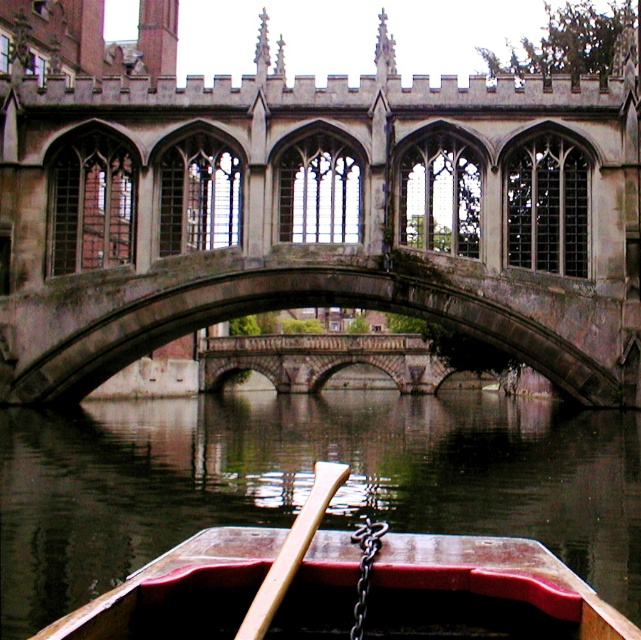
Can you confirm if stone gothic bridge at center is wider than wooden canoe at center?

Yes, stone gothic bridge at center is wider than wooden canoe at center.

Between stone gothic bridge at center and wooden canoe at center, which one appears on the left side from the viewer's perspective?

stone gothic bridge at center is more to the left.

Is point (463, 296) positioned before point (542, 592)?

No, it is behind (542, 592).

Locate an element on the screen. The image size is (641, 640). stone gothic bridge at center is located at coordinates (317, 214).

Which of these two, stone gothic bridge at center or wooden at center, stands shorter?

With less height is wooden at center.

In the scene shown: Is stone gothic bridge at center smaller than wooden at center?

No, stone gothic bridge at center is not smaller than wooden at center.

This screenshot has height=640, width=641. What do you see at coordinates (317, 214) in the screenshot?
I see `stone gothic bridge at center` at bounding box center [317, 214].

The image size is (641, 640). What are the coordinates of `stone gothic bridge at center` in the screenshot? It's located at (317, 214).

Based on the photo, who is positioned more to the left, stone gothic bridge at center or dark water at center?

Positioned to the left is stone gothic bridge at center.

Where is `stone gothic bridge at center`? This screenshot has height=640, width=641. stone gothic bridge at center is located at coordinates (317, 214).